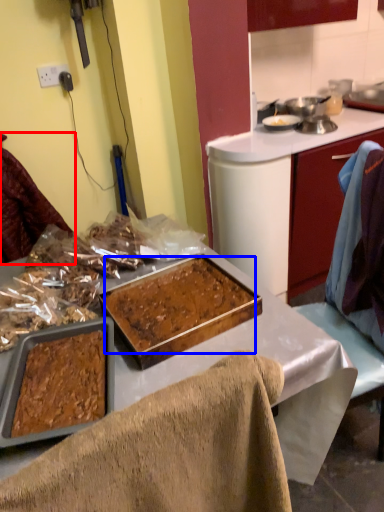
Question: Which object appears closest to the camera in this image, leftover (highlighted by a red box) or food (highlighted by a blue box)?

Choices:
 (A) leftover
 (B) food

Answer: (B)